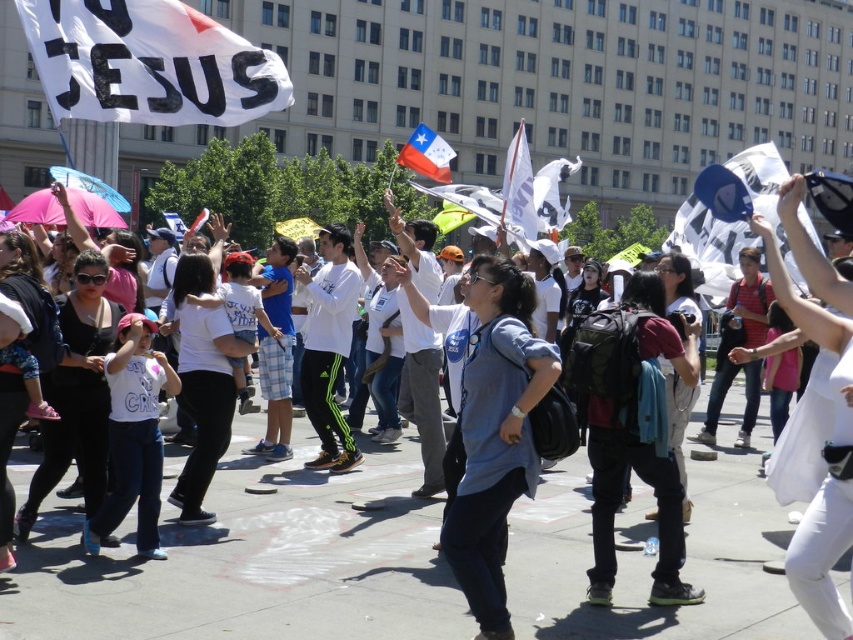
Question: Is matte gray shirt at center thinner than white paper flag at upper right?

Choices:
 (A) yes
 (B) no

Answer: (A)

Question: Does white paper flag at center lie behind yellow fabric flag at center?

Choices:
 (A) no
 (B) yes

Answer: (A)

Question: Which point appears farthest from the camera in this image?

Choices:
 (A) (466, 218)
 (B) (558, 179)

Answer: (B)

Question: Estimate the real-world distances between objects in this image. Which object is farther from the matte gray shirt at center?

Choices:
 (A) white paper flag at upper right
 (B) white paper flag at center

Answer: (A)

Question: Which of these objects is positioned closest to the white fabric flag at center?

Choices:
 (A) polished fabric chilean flag at upper center
 (B) yellow fabric flag at center
 (C) white paper flag at center

Answer: (B)

Question: Can you confirm if white paper flag at upper right is positioned to the left of white paper flag at center?

Choices:
 (A) yes
 (B) no

Answer: (B)